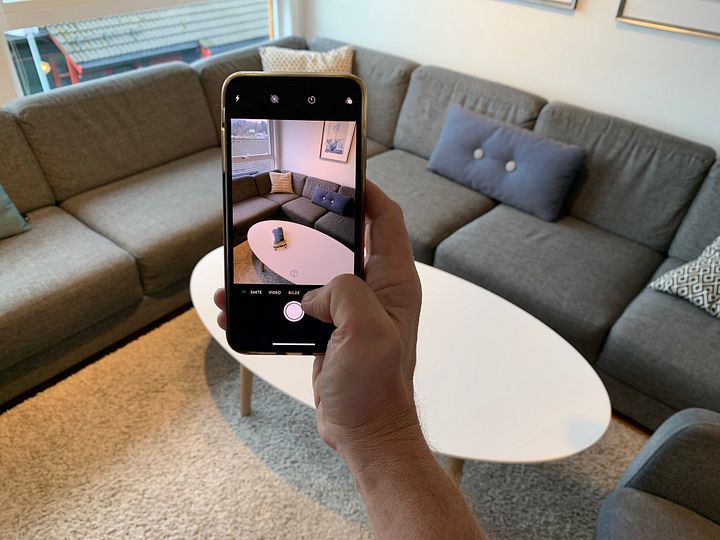
This screenshot has height=540, width=720. Identify the location of window. click(117, 48).